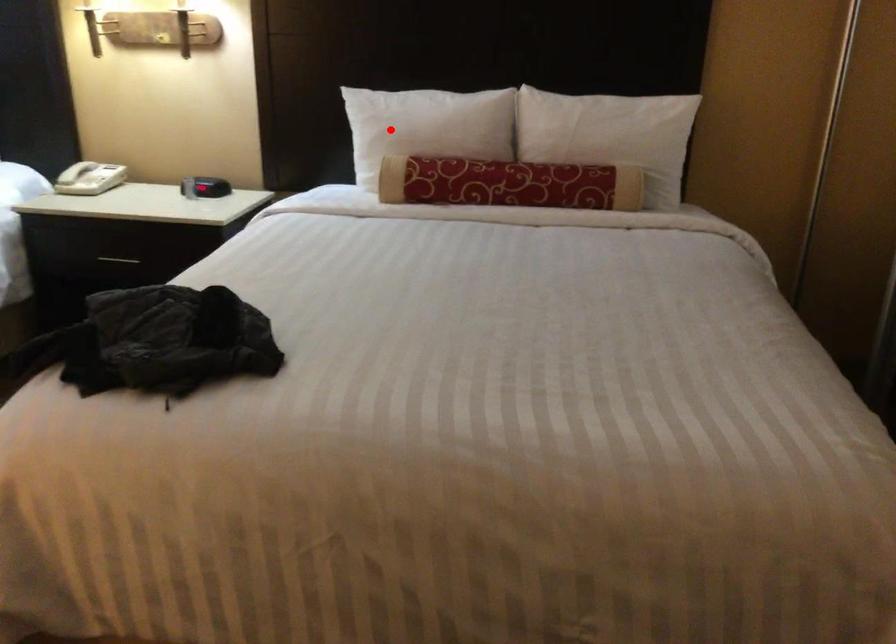
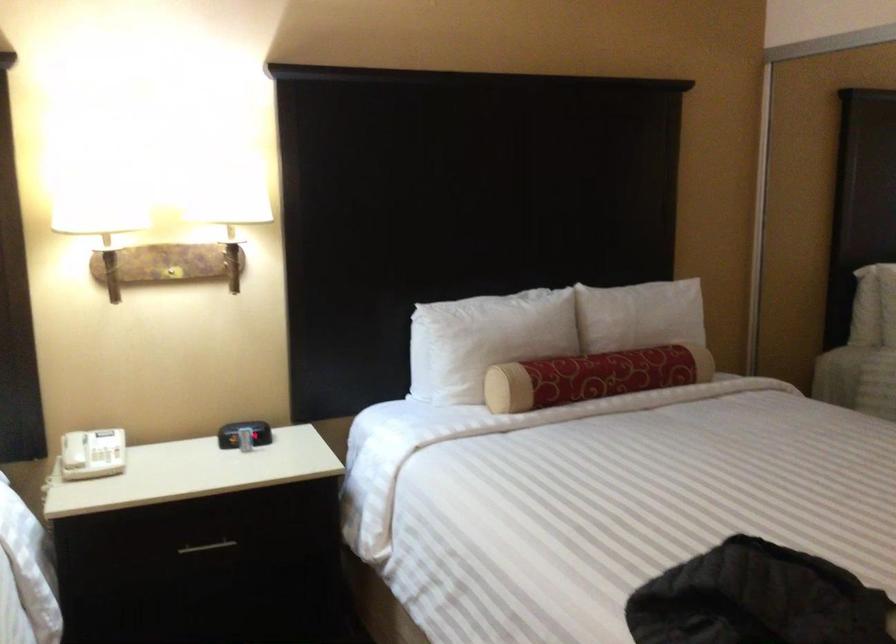
The point at the highlighted location is marked in the first image. Where is the corresponding point in the second image?

(485, 339)